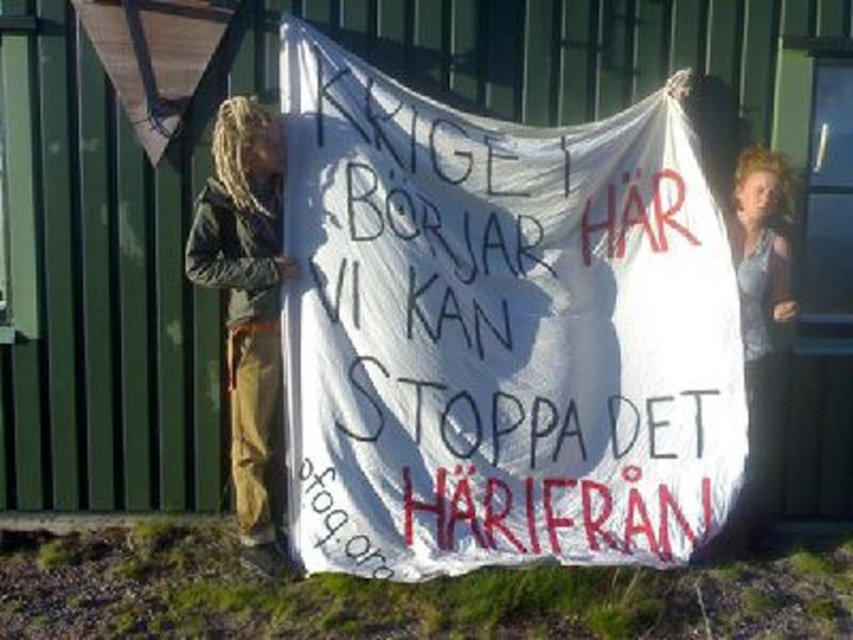
You are a photographer trying to capture a clear shot of both the white paper banner at center and the blonde hair at upper right. Based on their positions, which object will appear larger in your photo?

The white paper banner at center will appear larger in the photo because it is closer to the viewer than the blonde hair at upper right.

You are a photographer trying to capture a clear shot of both the brown leather jacket at left and the blonde hair at upper right in the image. Based on their positions, which object is covering part of the other?

The brown leather jacket at left is positioned over blonde hair at upper right, so the jacket is covering part of the blonde hair.